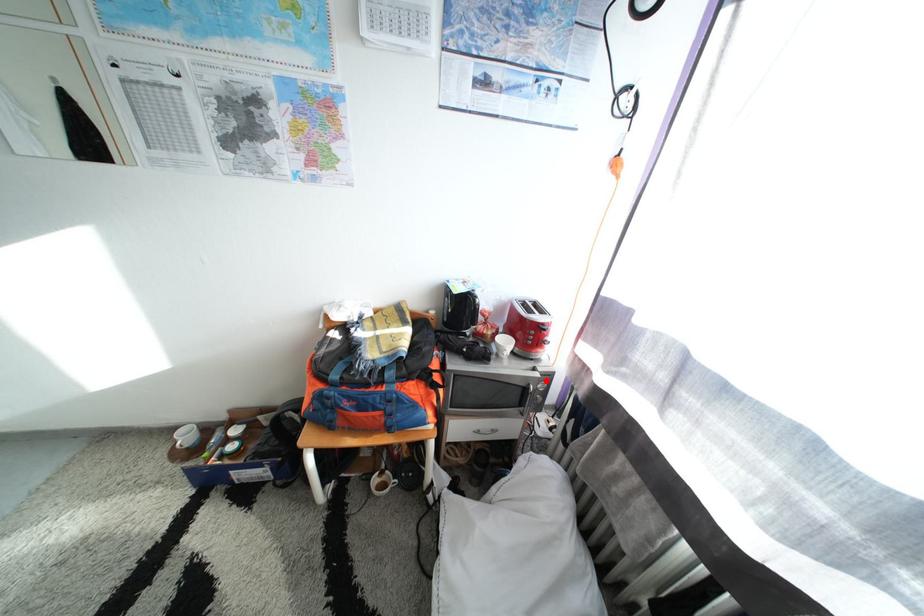
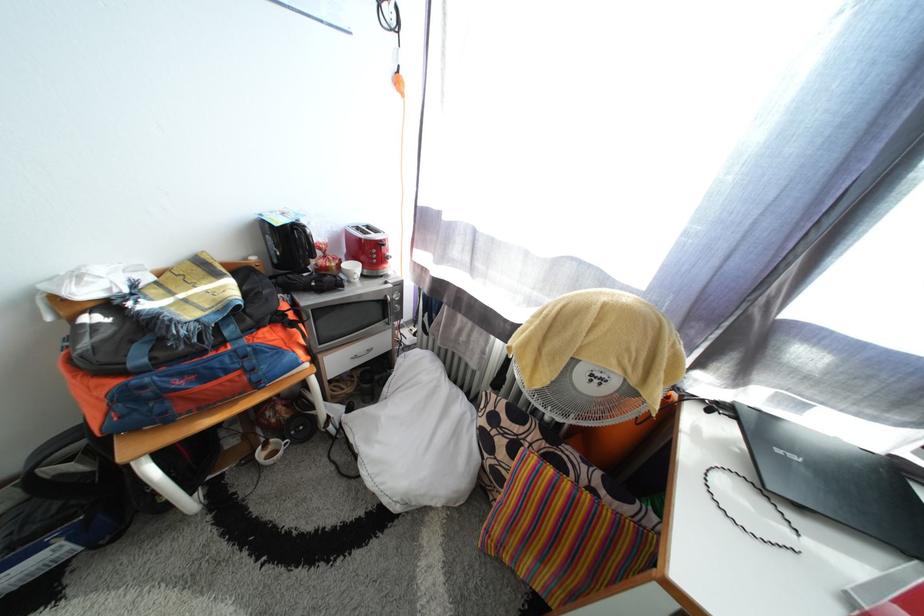
Question: I am providing you with two images of the same scene from different viewpoints. Image1 has a red point marked. In image2, the corresponding 3D location appears at what relative position? Reply with the corresponding letter.

Choices:
 (A) Closer
 (B) Farther

Answer: (A)